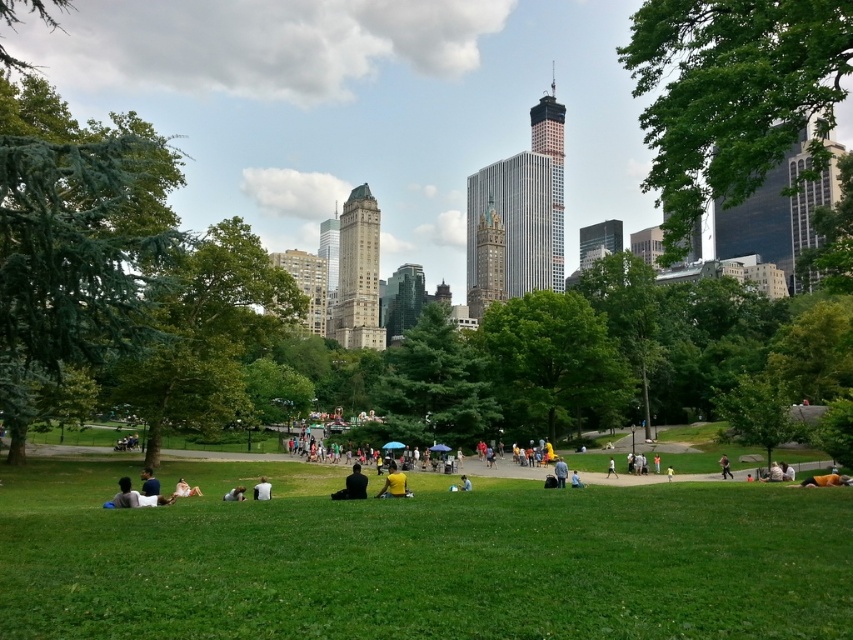
Question: Which point appears closest to the camera in this image?

Choices:
 (A) (459, 484)
 (B) (349, 493)

Answer: (B)

Question: Is green grassy field at center in front of light brown fabric at lower left?

Choices:
 (A) yes
 (B) no

Answer: (A)

Question: Among these points, which one is nearest to the camera?

Choices:
 (A) (357, 483)
 (B) (239, 488)
 (C) (193, 484)
 (D) (404, 476)

Answer: (A)

Question: Which of the following is the farthest from the observer?

Choices:
 (A) (358, 488)
 (B) (579, 486)
 (C) (144, 490)
 (D) (198, 492)

Answer: (B)

Question: Is yellow matte shirt at center bigger than light blue shirt at lower center?

Choices:
 (A) no
 (B) yes

Answer: (B)

Question: Is yellow fabric person at lower right in front of light blue shirt at lower center?

Choices:
 (A) yes
 (B) no

Answer: (A)